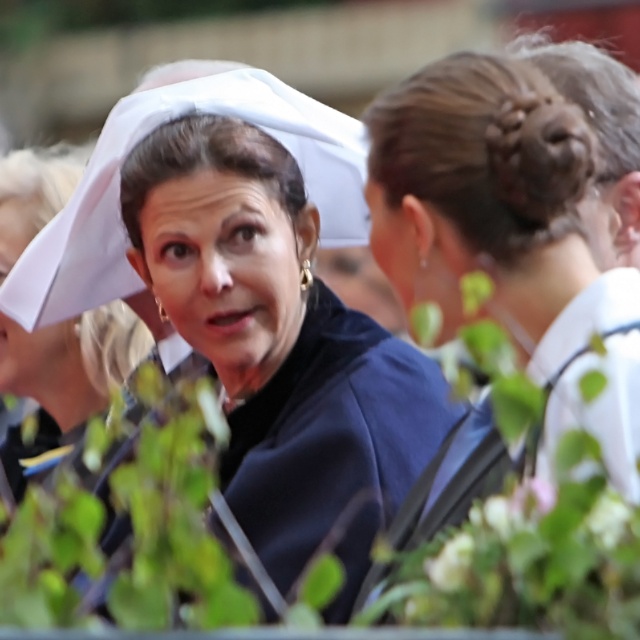
You are a photographer at a hospital event. You need to capture a photo of the sleek dark hair bun at upper right and the white matte nurse hat at center. Which object should you zoom in on to make the thinner one appear larger in the frame?

The sleek dark hair bun at upper right is thinner than the white matte nurse hat at center, so you should zoom in on the sleek dark hair bun at upper right to make it appear larger in the frame.

You are standing in a crowded room and see a point at coordinates (280, 346). What object is located at that point?

The point at coordinates (280, 346) corresponds to the matte black dress at center.

You are a photographer trying to capture a candid shot of the two people in the scene. You need to position yourself so that the sleek dark hair bun at upper right and the white matte nurse hat at center are both visible in the frame. Based on their positions, which object should be placed closer to the right side of your camera viewfinder?

The sleek dark hair bun at upper right should be placed closer to the right side of the camera viewfinder because it is positioned to the right of the white matte nurse hat at center.